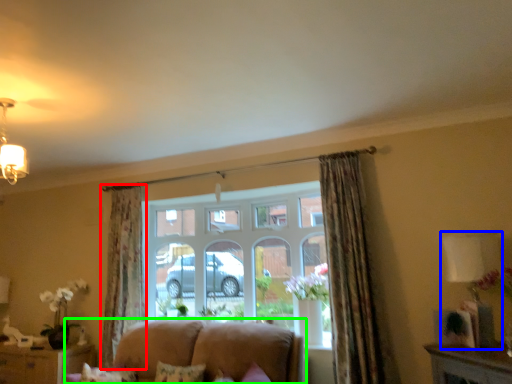
Question: Which is farther away from curtain (highlighted by a red box)? lamp (highlighted by a blue box) or studio couch (highlighted by a green box)?

Choices:
 (A) lamp
 (B) studio couch

Answer: (A)